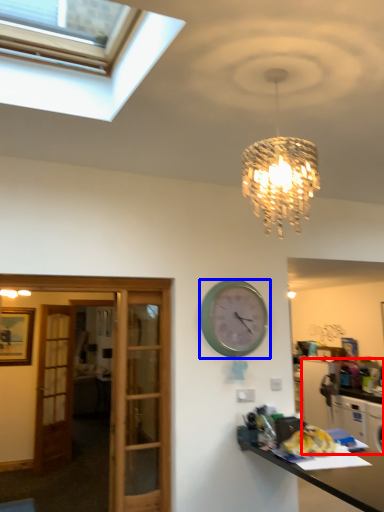
Question: Which point is further to the camera, cabinetry (highlighted by a red box) or wall clock (highlighted by a blue box)?

Choices:
 (A) cabinetry
 (B) wall clock

Answer: (A)